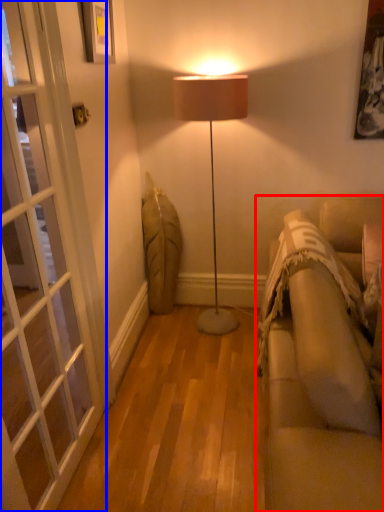
Question: Which object appears farthest to the camera in this image, studio couch (highlighted by a red box) or screen door (highlighted by a blue box)?

Choices:
 (A) studio couch
 (B) screen door

Answer: (B)